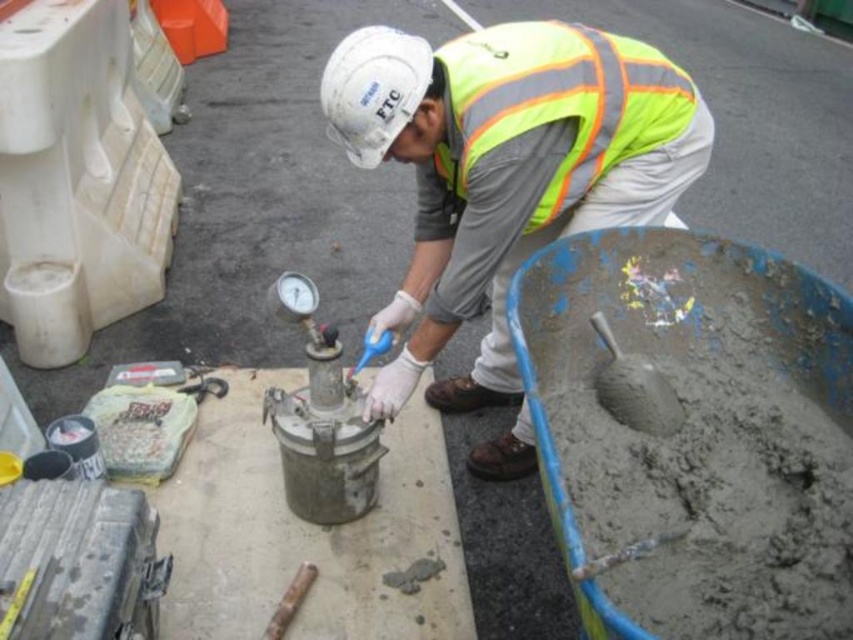
Question: Is high-visibility fabric safety vest at center smaller than smooth concrete shovel at lower right?

Choices:
 (A) no
 (B) yes

Answer: (A)

Question: Which object appears closest to the camera in this image?

Choices:
 (A) smooth concrete shovel at lower right
 (B) reflective yellow-green safety vest at center

Answer: (B)

Question: Can you confirm if reflective yellow-green safety vest at center is positioned to the left of high-visibility fabric safety vest at center?

Choices:
 (A) yes
 (B) no

Answer: (A)

Question: Which point is farther from the camera taking this photo?

Choices:
 (A) (613, 381)
 (B) (344, 61)

Answer: (A)

Question: Which point appears farthest from the camera in this image?

Choices:
 (A) (641, 112)
 (B) (648, 173)
 (C) (386, 154)

Answer: (C)

Question: Can you confirm if white hard hat at upper center is positioned to the left of smooth concrete shovel at lower right?

Choices:
 (A) no
 (B) yes

Answer: (B)